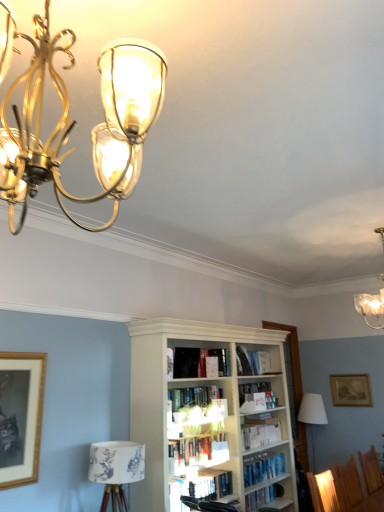
Question: Is wooden picture frame at upper right, the 2th picture frame viewed from the top, bigger or smaller than wooden framed print at lower left, the second picture frame from the right?

Choices:
 (A) small
 (B) big

Answer: (A)

Question: From the image's perspective, relative to wooden framed print at lower left, which is the 2th picture frame from back to front, is wooden picture frame at upper right, which is counted as the 2th picture frame, starting from the front, above or below?

Choices:
 (A) below
 (B) above

Answer: (A)

Question: Considering the real-world distances, which object is farthest from the white fabric lampshade at right?

Choices:
 (A) white paper book at center, which ranks as the second book in bottom-to-top order
 (B) gold metallic chandelier at upper left, which is counted as the 1th lamp, starting from the left
 (C) hardcover books at center, placed as the fourth book when sorted from bottom to top
 (D) hardcover books at center, arranged as the 3th book when viewed from the top
 (E) white wooden bookshelf at lower center

Answer: (B)

Question: Which object is positioned farthest from the white fabric lampshade at right?

Choices:
 (A) hardcover books at center, arranged as the 3th book when viewed from the top
 (B) hardcover book at center, the 5th book when ordered from bottom to top
 (C) white paper book at center, which ranks as the second book in bottom-to-top order
 (D) black leather swivel chair at center
 (E) translucent glass chandelier at upper right, acting as the 2th lamp starting from the front

Answer: (D)